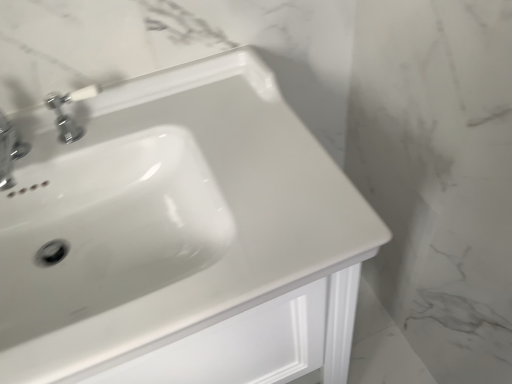
Locate an element on the screen. unoccupied region to the right of chrome metallic faucet at upper left, which is the 1th tap from left to right is located at coordinates (105, 140).